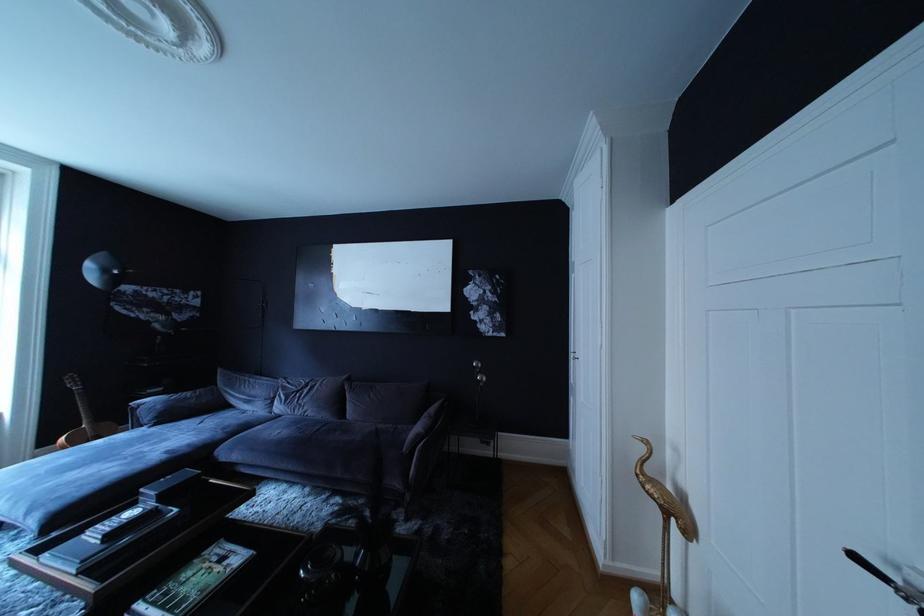
I want to click on door handle, so click(894, 578).